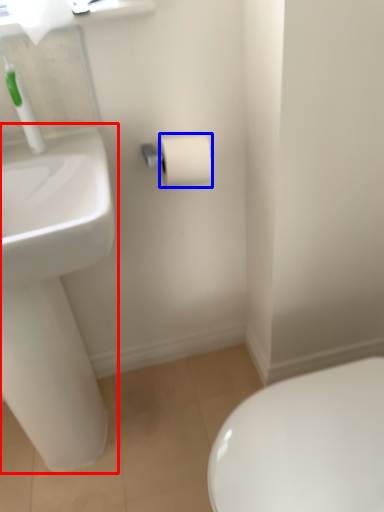
Question: Which object appears closest to the camera in this image, sink (highlighted by a red box) or toilet paper (highlighted by a blue box)?

Choices:
 (A) sink
 (B) toilet paper

Answer: (A)